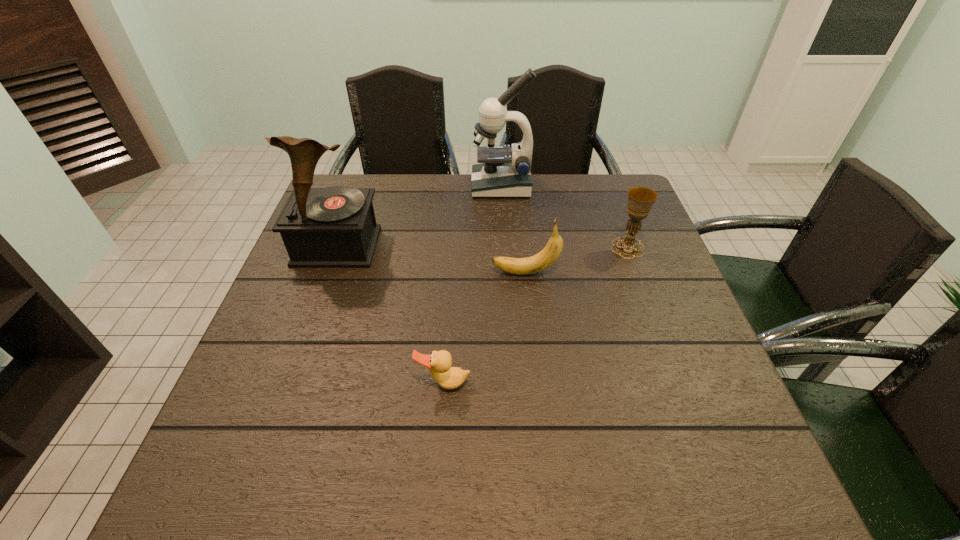
Where is `vacant area between the rightmost object and the farthest object`? This screenshot has height=540, width=960. vacant area between the rightmost object and the farthest object is located at coordinates (564, 217).

Where is `free space between the banana and the nearest object`? Image resolution: width=960 pixels, height=540 pixels. free space between the banana and the nearest object is located at coordinates (485, 328).

Where is `free space between the banana and the leftmost object`? free space between the banana and the leftmost object is located at coordinates (431, 259).

Where is `free space that is in between the banana and the microscope`? The width and height of the screenshot is (960, 540). free space that is in between the banana and the microscope is located at coordinates (514, 229).

Locate which object ranks fourth in proximity to the banana. Please provide its 2D coordinates. Your answer should be formatted as a tuple, i.e. [(x, y)], where the tuple contains the x and y coordinates of a point satisfying the conditions above.

[(334, 227)]

Select which object is the third closest to the farthest object. Please provide its 2D coordinates. Your answer should be formatted as a tuple, i.e. [(x, y)], where the tuple contains the x and y coordinates of a point satisfying the conditions above.

[(521, 266)]

Locate an element on the screen. This screenshot has width=960, height=540. free region that satisfies the following two spatial constraints: 1. at the eyepiece of the farthest object; 2. at the horn opening of the phonograph_record is located at coordinates pyautogui.click(x=505, y=246).

You are a GUI agent. You are given a task and a screenshot of the screen. Output one action in this format:
    pyautogui.click(x=<x>, y=<y>)
    Task: Click on the vacant space that satisfies the following two spatial constraints: 1. at the eyepiece of the farthest object; 2. on the left side of the rightmost object
    The image size is (960, 540).
    Given the screenshot: What is the action you would take?
    pyautogui.click(x=505, y=248)

Find the location of a particular element. vacant position in the image that satisfies the following two spatial constraints: 1. at the horn opening of the chalice; 2. on the left side of the phonograph_record is located at coordinates (337, 248).

Identify the location of free space that satisfies the following two spatial constraints: 1. at the start of the peel on the banana; 2. on the beak of the shortest object. The image size is (960, 540). (537, 383).